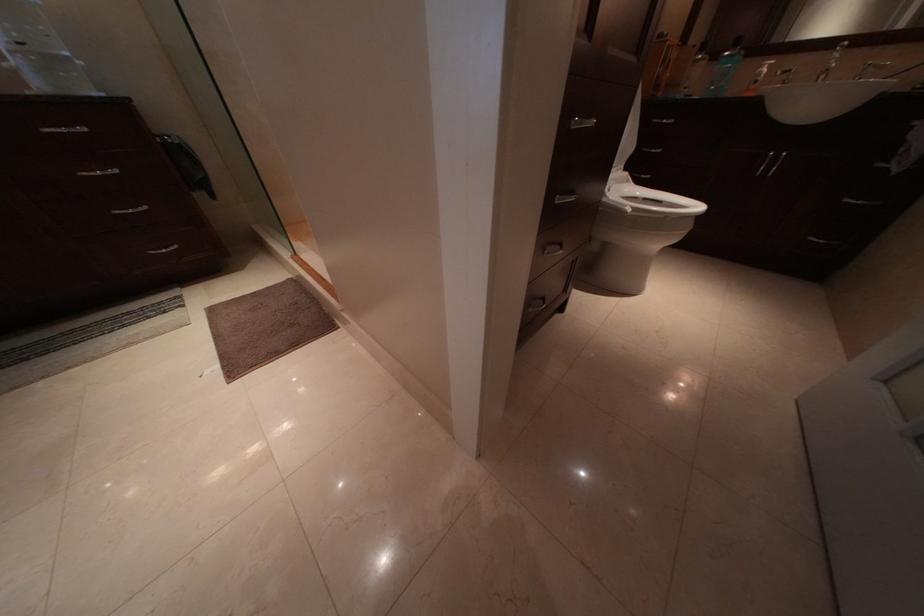
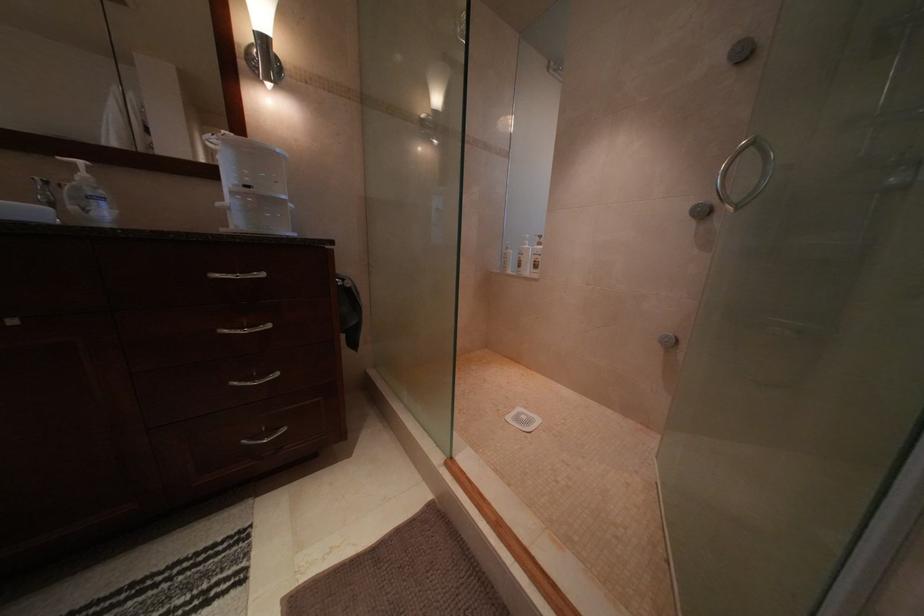
The images are taken continuously from a first-person perspective. In which direction are you moving?

The movement direction of the cameraman is left, forward.